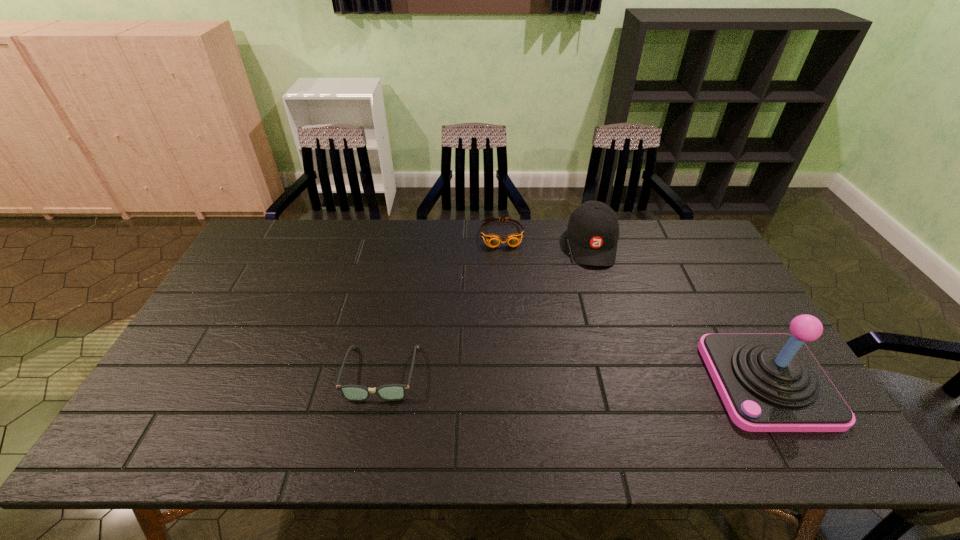
This screenshot has height=540, width=960. In order to click on vacant space situated forward from the base of the tallest object in this screenshot , I will do `click(646, 382)`.

Locate an element on the screen. vacant point located 0.130m with a logo on the front of the baseball cap is located at coordinates tap(602, 297).

Where is `vacant space located 0.300m with a logo on the front of the baseball cap`? This screenshot has height=540, width=960. vacant space located 0.300m with a logo on the front of the baseball cap is located at coordinates (609, 340).

Locate an element on the screen. vacant space located with a logo on the front of the baseball cap is located at coordinates (605, 313).

Identify the location of vacant region located with the lenses facing forward on the third object from right to left. (509, 287).

This screenshot has height=540, width=960. Identify the location of free region located with the lenses facing forward on the third object from right to left. (512, 303).

Locate an element on the screen. The width and height of the screenshot is (960, 540). vacant area situated 0.260m with the lenses facing forward on the third object from right to left is located at coordinates (512, 303).

What are the coordinates of `baseball cap that is positioned at the far edge` in the screenshot? It's located at (593, 229).

At what (x,y) coordinates should I click in order to perform the action: click on goggles present at the far edge. Please return your answer as a coordinate pair (x, y). This screenshot has width=960, height=540. Looking at the image, I should click on (493, 240).

In order to click on spectacles positioned at the near edge in this screenshot , I will do `click(391, 392)`.